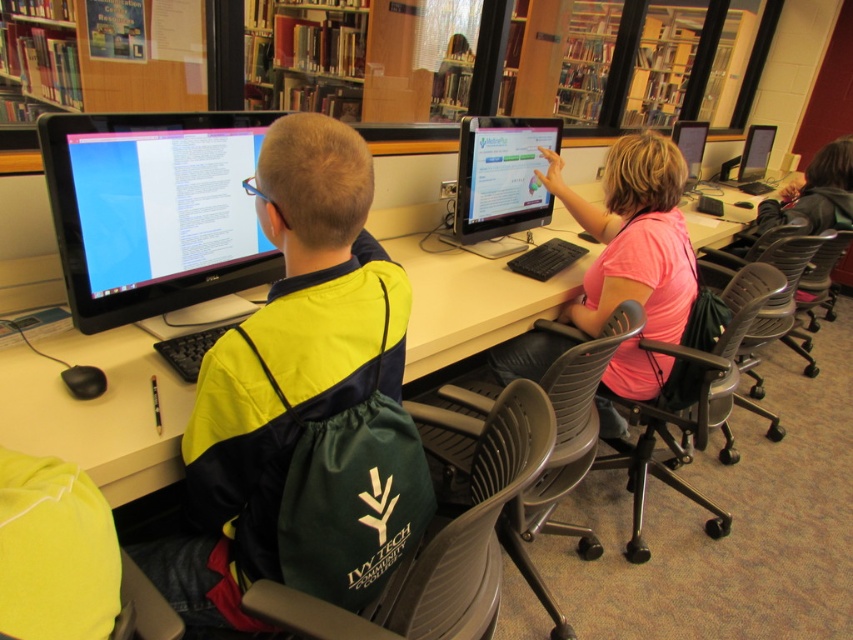
Who is lower down, matte black monitor at upper right or matte black monitor at upper center?

matte black monitor at upper center

Does point (775, 128) lie behind point (699, 148)?

Yes, it is.

Locate an element on the screen. matte black monitor at upper right is located at coordinates (750, 160).

Is pink matte shirt at center below matte black monitor at upper right?

Yes.

Which is below, pink matte shirt at center or matte black monitor at upper right?

pink matte shirt at center is below.

Is point (601, 300) in front of point (728, 177)?

Yes, it is in front of point (728, 177).

You are a GUI agent. You are given a task and a screenshot of the screen. Output one action in this format:
    pyautogui.click(x=<x>, y=<y>)
    Task: Click on the pink matte shirt at center
    The height and width of the screenshot is (640, 853).
    Given the screenshot: What is the action you would take?
    pyautogui.click(x=633, y=236)

Describe the element at coordinates (97, 410) in the screenshot. Image resolution: width=853 pixels, height=640 pixels. I see `matte plastic desk at center` at that location.

Who is positioned more to the right, matte plastic desk at center or matte black monitor at upper center?

matte black monitor at upper center is more to the right.

This screenshot has height=640, width=853. What are the coordinates of `matte plastic desk at center` in the screenshot? It's located at (97, 410).